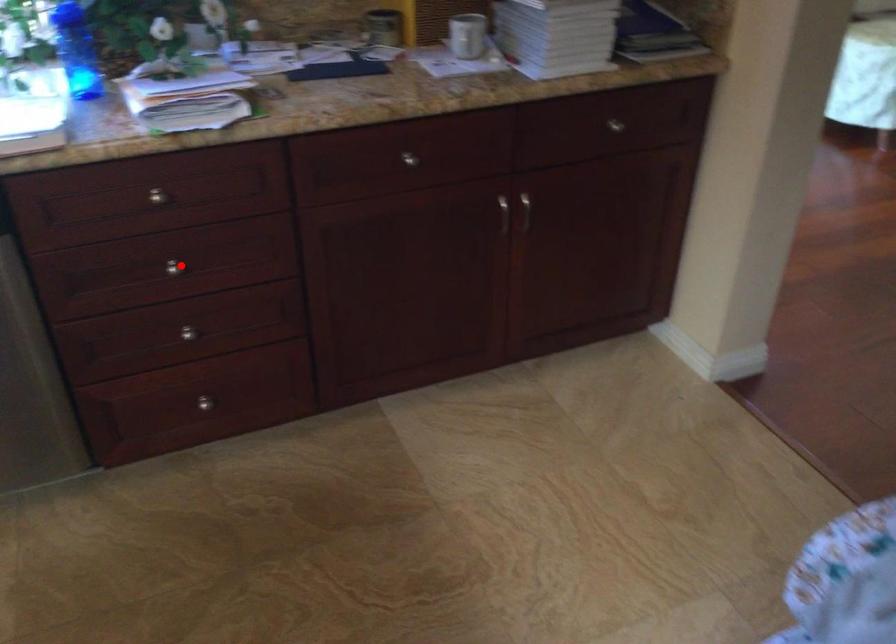
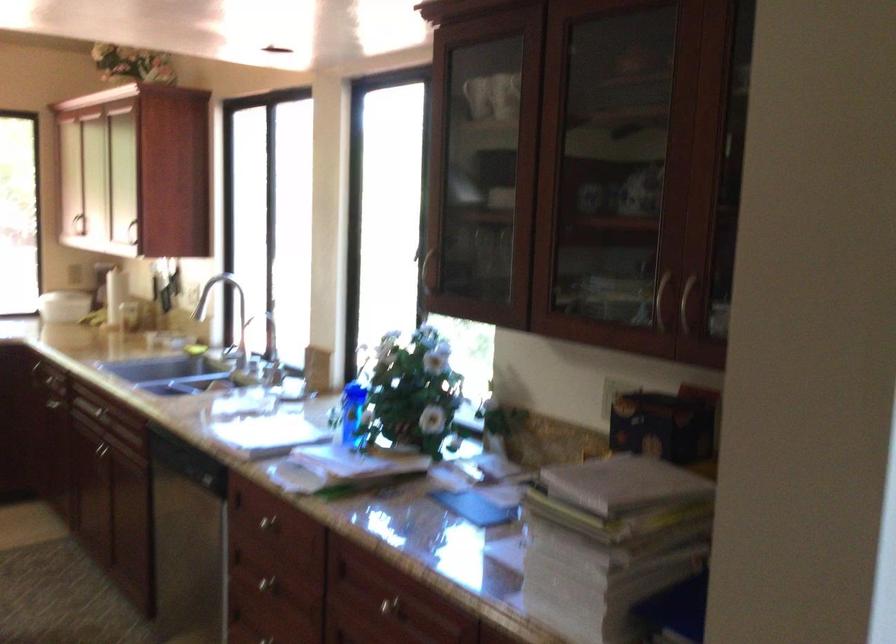
Question: I am providing you with two images of the same scene from different viewpoints. Given a red point in image1, look at the same physical point in image2. Is it:

Choices:
 (A) Closer to the viewpoint
 (B) Farther from the viewpoint

Answer: (B)